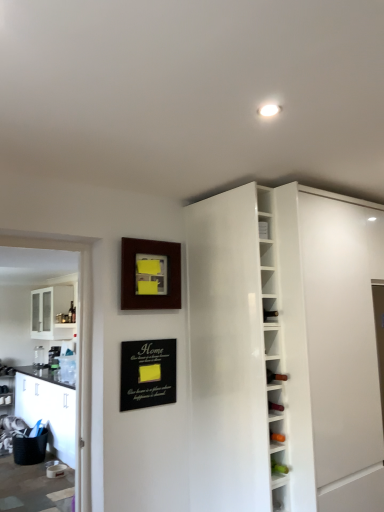
Question: From a real-world perspective, is green matte bottle at lower right beneath black matte bulletin board at lower center?

Choices:
 (A) no
 (B) yes

Answer: (B)

Question: Does green matte bottle at lower right have a lesser width compared to black matte bulletin board at lower center?

Choices:
 (A) yes
 (B) no

Answer: (B)

Question: Is green matte bottle at lower right shorter than black matte bulletin board at lower center?

Choices:
 (A) no
 (B) yes

Answer: (B)

Question: Considering the relative positions of green matte bottle at lower right and black matte bulletin board at lower center in the image provided, is green matte bottle at lower right to the right of black matte bulletin board at lower center from the viewer's perspective?

Choices:
 (A) no
 (B) yes

Answer: (B)

Question: From a real-world perspective, is green matte bottle at lower right physically above black matte bulletin board at lower center?

Choices:
 (A) yes
 (B) no

Answer: (B)

Question: Does green matte bottle at lower right have a greater height compared to black matte bulletin board at lower center?

Choices:
 (A) yes
 (B) no

Answer: (B)

Question: Is green matte bottle at lower right not inside white glossy cabinet at upper right?

Choices:
 (A) no
 (B) yes

Answer: (B)

Question: Does green matte bottle at lower right lie behind white glossy cabinet at upper right?

Choices:
 (A) no
 (B) yes

Answer: (B)

Question: Does green matte bottle at lower right have a greater height compared to white glossy cabinet at upper right?

Choices:
 (A) yes
 (B) no

Answer: (B)

Question: Is green matte bottle at lower right next to white glossy cabinet at upper right?

Choices:
 (A) no
 (B) yes

Answer: (A)

Question: Is green matte bottle at lower right smaller than white glossy cabinet at upper right?

Choices:
 (A) yes
 (B) no

Answer: (A)

Question: From a real-world perspective, does green matte bottle at lower right sit lower than white glossy cabinet at upper right?

Choices:
 (A) no
 (B) yes

Answer: (B)

Question: Is wooden picture frame at upper center in contact with green matte bottle at lower right?

Choices:
 (A) no
 (B) yes

Answer: (A)